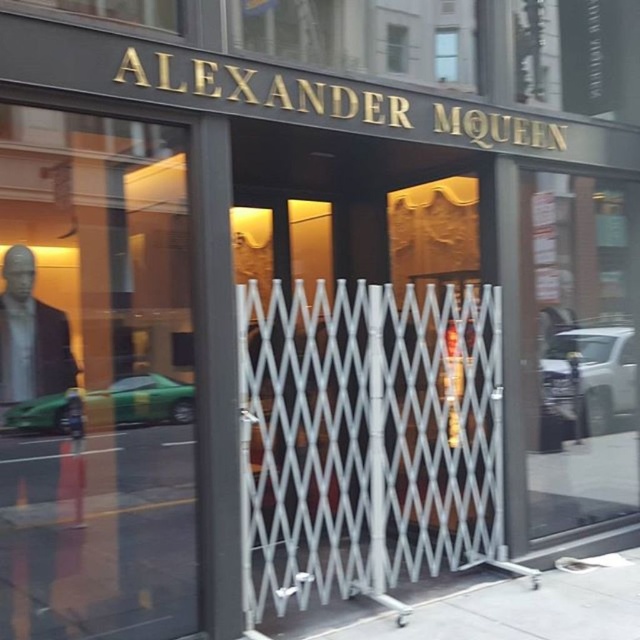
Question: Which of these objects is positioned farthest from the green glass mannequin at left?

Choices:
 (A) metallic silver gate at center
 (B) transparent glass door at center

Answer: (B)

Question: Which is farther from the transparent glass door at center?

Choices:
 (A) metallic silver gate at center
 (B) green glass mannequin at left

Answer: (B)

Question: Is green glass mannequin at left to the left of metallic silver gate at center from the viewer's perspective?

Choices:
 (A) yes
 (B) no

Answer: (A)

Question: Does green glass mannequin at left appear over transparent glass door at center?

Choices:
 (A) no
 (B) yes

Answer: (A)

Question: Based on their relative distances, which object is farther from the green glass mannequin at left?

Choices:
 (A) transparent glass door at center
 (B) metallic silver gate at center

Answer: (A)

Question: From the image, what is the correct spatial relationship of green glass mannequin at left in relation to transparent glass door at center?

Choices:
 (A) left
 (B) right

Answer: (A)